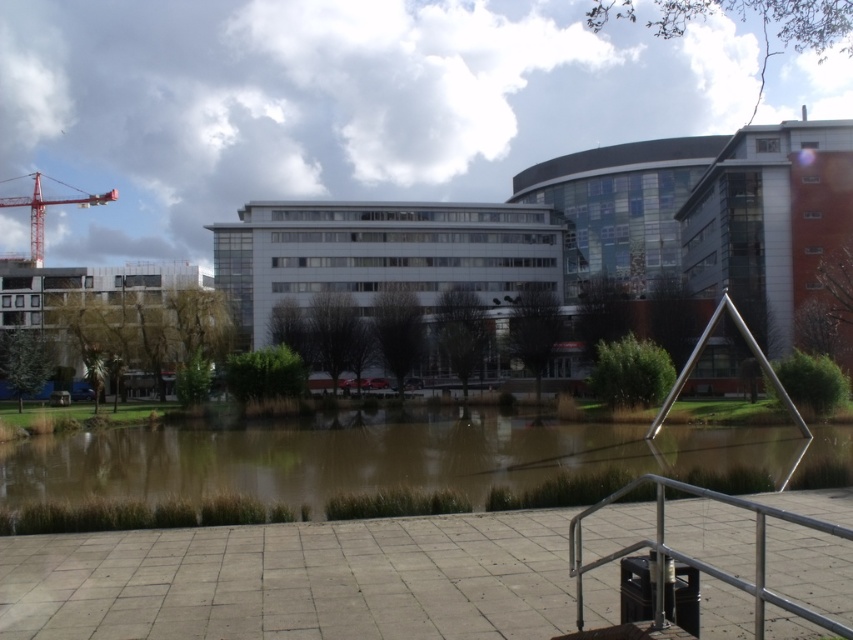
You are standing on the viewing platform overlooking the brown muddy water at center and the silver metallic rail at lower right. Which object is closer to you?

The brown muddy water at center is closer to you than the silver metallic rail at lower right because it is further to the viewer according to the description.

You are an architect planning to install a new light pole between the brown muddy water at center and the red metal crane at upper left. Based on their positions, where should the light pole be placed?

The light pole should be placed between the brown muddy water at center and the red metal crane at upper left, as the brown muddy water at center is positioned under the red metal crane at upper left, indicating they are aligned vertically. The light pole can be placed along this vertical line between them.